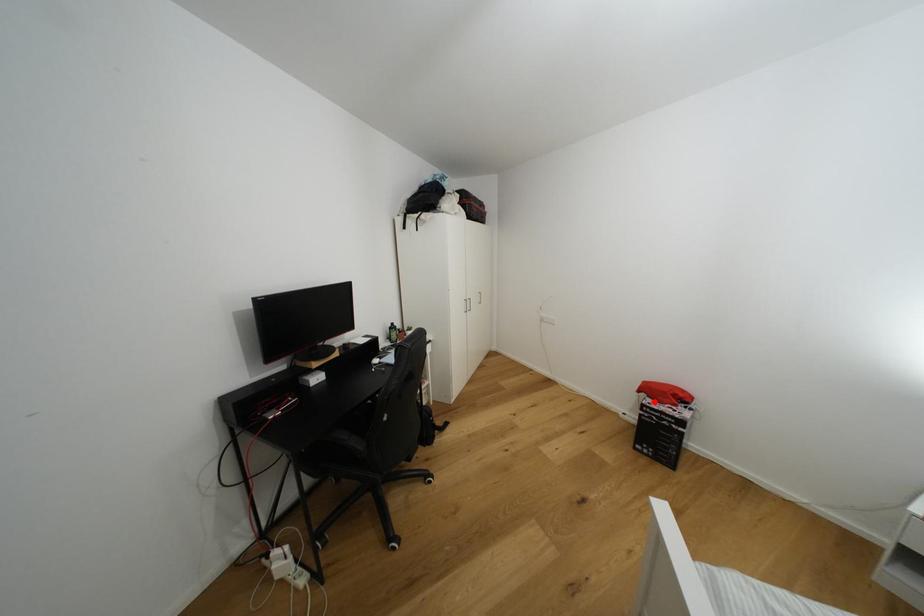
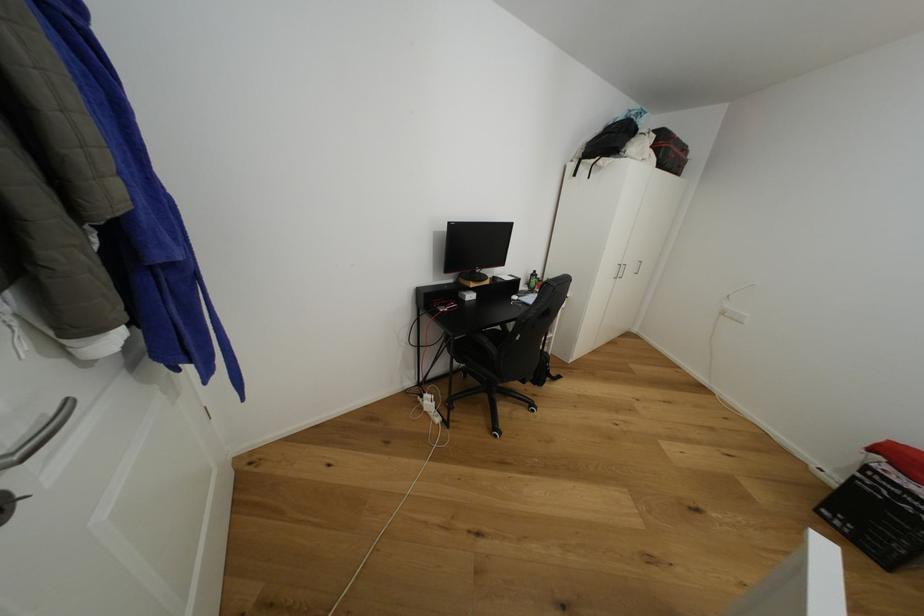
Find the pixel in the second image that matches the highlighted location in the first image.

(893, 469)